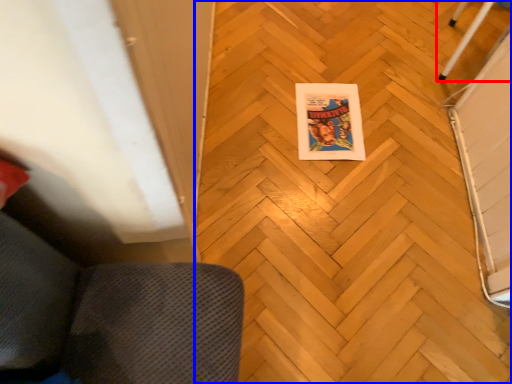
Question: Which object appears closest to the camera in this image, furniture (highlighted by a red box) or plywood (highlighted by a blue box)?

Choices:
 (A) furniture
 (B) plywood

Answer: (B)